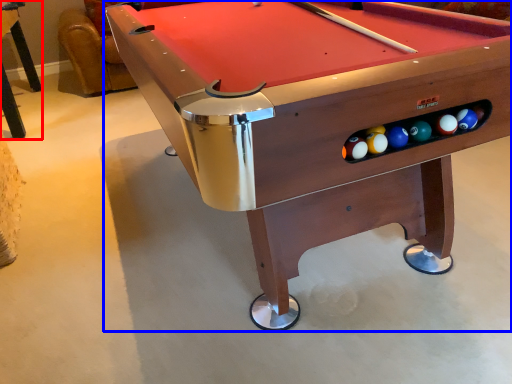
Question: Which object is closer to the camera taking this photo, table (highlighted by a red box) or billiard table (highlighted by a blue box)?

Choices:
 (A) table
 (B) billiard table

Answer: (B)